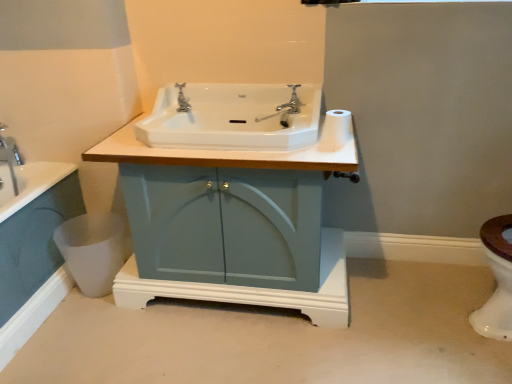
The height and width of the screenshot is (384, 512). Find the location of `free space to the left of chrome metallic faucet at upper center`. free space to the left of chrome metallic faucet at upper center is located at coordinates (256, 116).